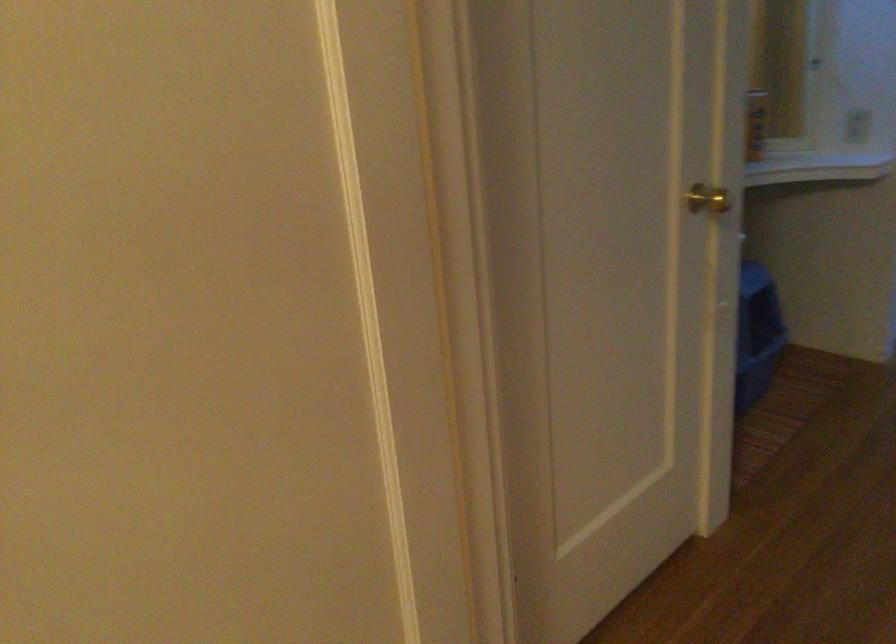
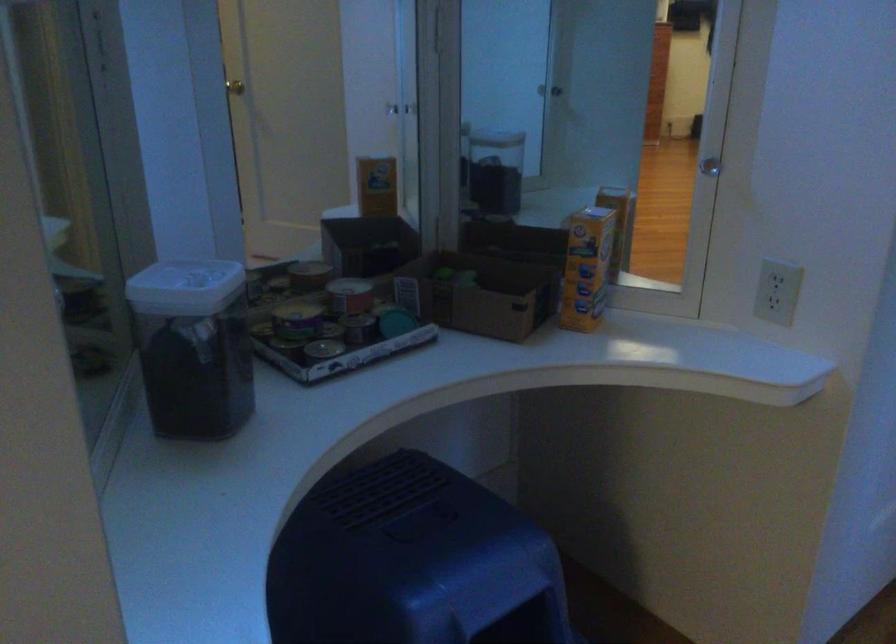
In a continuous first-person perspective shot, in which direction is the camera moving?

The cameraman walked toward right, forward.